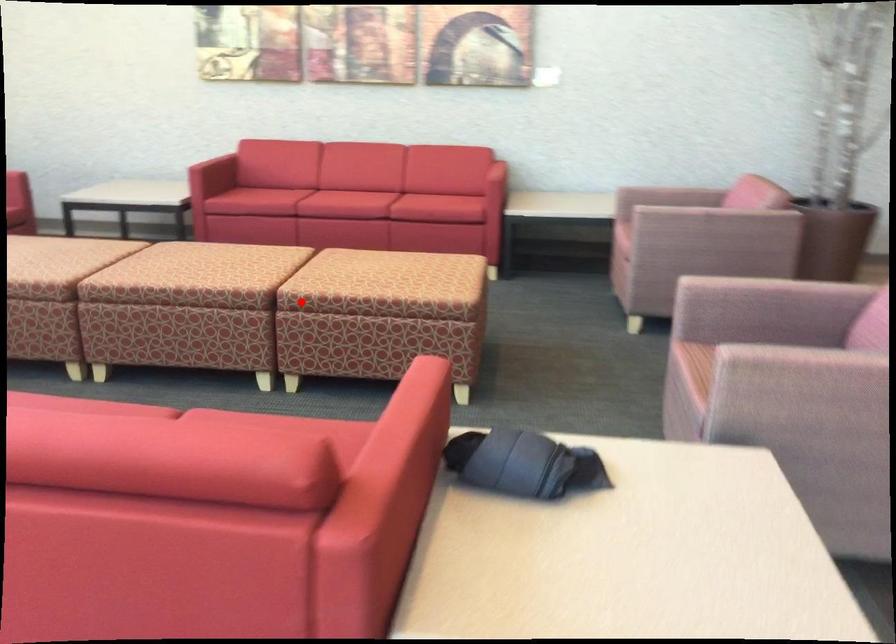
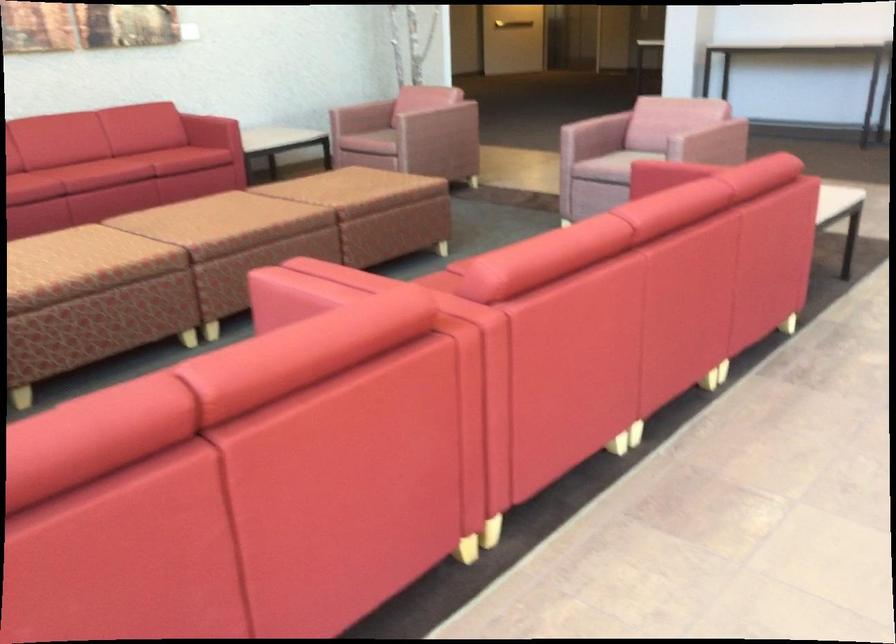
Question: I am providing you with two images of the same scene from different viewpoints. In image1, a red point is highlighted. Considering the same 3D point in image2, which of the following is correct?

Choices:
 (A) It is closer
 (B) It is farther

Answer: (B)